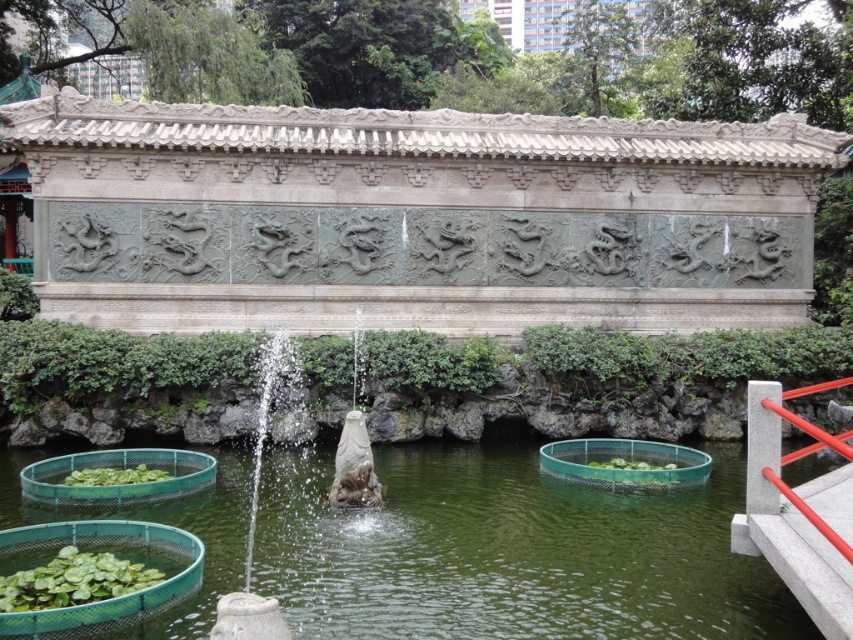
Between green water at fountain center and sandy stone fountain at center, which one appears on the right side from the viewer's perspective?

green water at fountain center is more to the right.

Based on the photo, can you confirm if green water at fountain center is shorter than sandy stone fountain at center?

Incorrect, green water at fountain center's height does not fall short of sandy stone fountain at center's.

I want to click on green water at fountain center, so click(x=509, y=550).